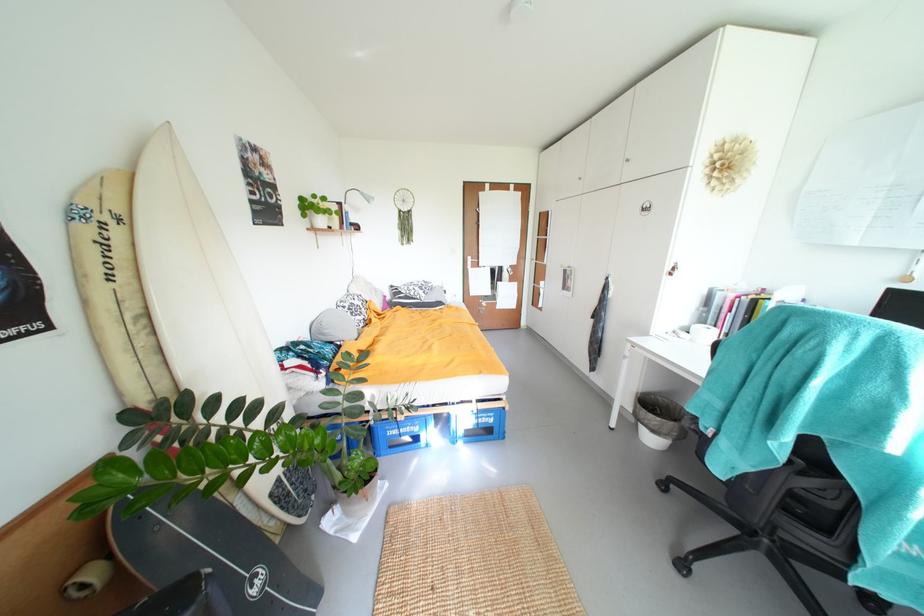
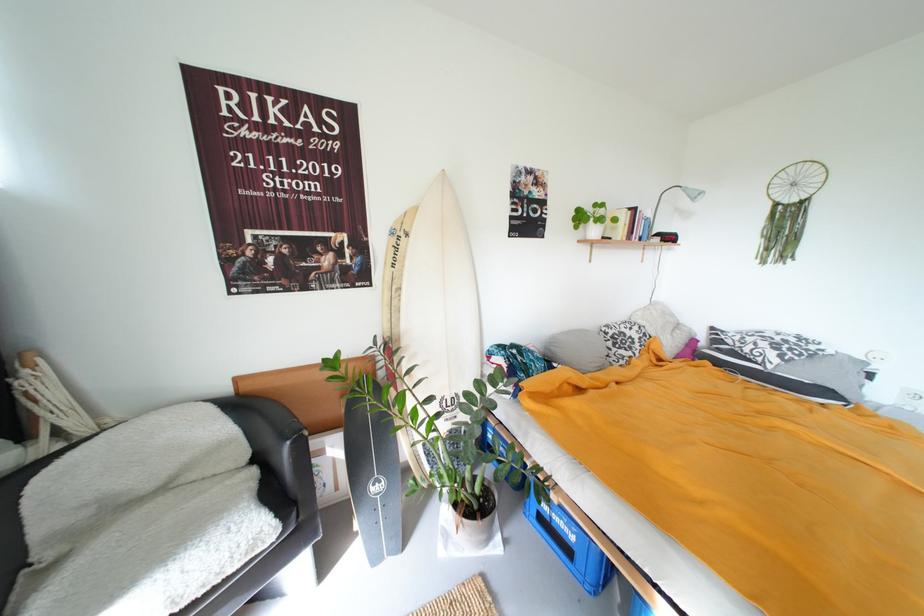
The point at (333, 333) is marked in the first image. Where is the corresponding point in the second image?

(560, 350)